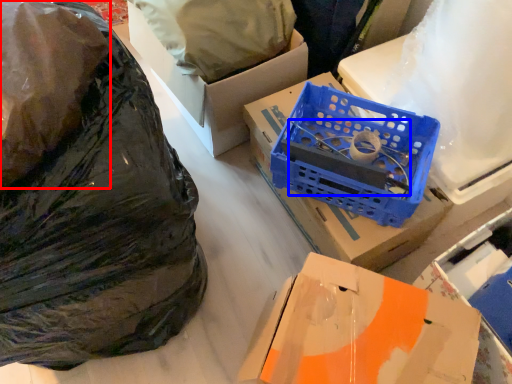
Question: Which of the following is the closest to the observer, plastic bag (highlighted by a red box) or wire (highlighted by a blue box)?

Choices:
 (A) plastic bag
 (B) wire

Answer: (A)